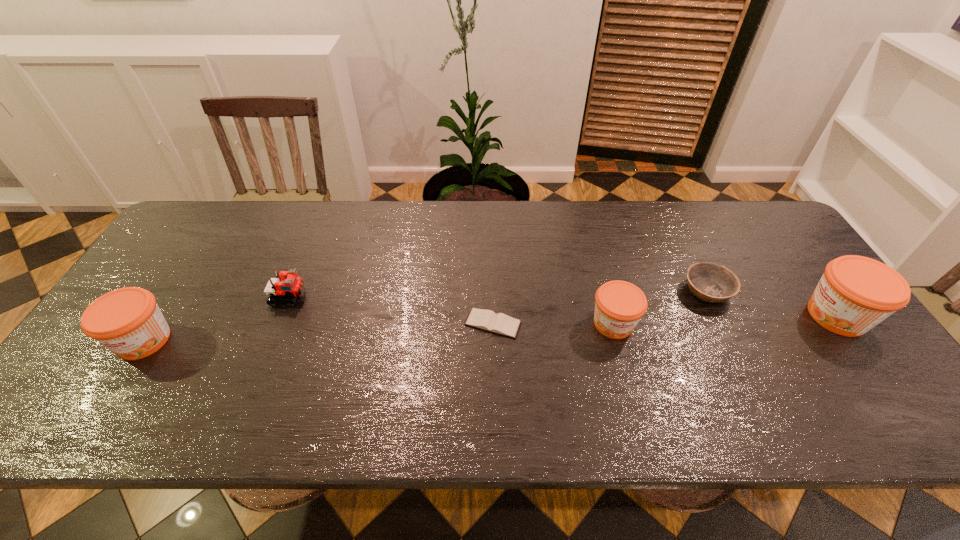
Image resolution: width=960 pixels, height=540 pixels. What are the coordinates of `the second tallest jam` in the screenshot? It's located at (127, 321).

In order to click on the leftmost object in this screenshot , I will do `click(127, 321)`.

The width and height of the screenshot is (960, 540). Identify the location of the second jam from right to left. (619, 306).

I want to click on the third object from right to left, so click(619, 306).

Identify the location of the rightmost jam. The width and height of the screenshot is (960, 540). (856, 293).

Find the location of `the fifth object from left to right`. the fifth object from left to right is located at coordinates (710, 282).

Identify the location of bowl. The width and height of the screenshot is (960, 540). (710, 282).

Where is `the fourth object from right to left`? Image resolution: width=960 pixels, height=540 pixels. the fourth object from right to left is located at coordinates (487, 320).

I want to click on diary, so click(x=487, y=320).

The image size is (960, 540). What are the coordinates of `the fifth object from right to left` in the screenshot? It's located at (292, 286).